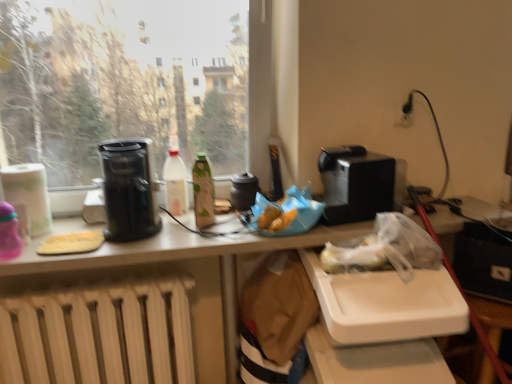
Question: Can you confirm if white matte bottle at center, arranged as the 2th bottle when viewed from the right, is thinner than transparent glass window at upper left?

Choices:
 (A) no
 (B) yes

Answer: (B)

Question: Is transparent glass window at upper left at the back of white matte bottle at center, acting as the 1th bottle starting from the left?

Choices:
 (A) no
 (B) yes

Answer: (B)

Question: From the image's perspective, is white matte bottle at center, arranged as the 2th bottle when viewed from the right, under transparent glass window at upper left?

Choices:
 (A) yes
 (B) no

Answer: (A)

Question: From a real-world perspective, is white matte bottle at center, arranged as the 2th bottle when viewed from the right, positioned over transparent glass window at upper left based on gravity?

Choices:
 (A) yes
 (B) no

Answer: (B)

Question: Does white matte bottle at center, arranged as the 2th bottle when viewed from the right, appear on the left side of transparent glass window at upper left?

Choices:
 (A) yes
 (B) no

Answer: (B)

Question: In terms of height, does black plastic toaster at upper right, which appears as the second appliance when viewed from the left, look taller or shorter compared to green matte bottle at center, which appears as the second bottle when viewed from the left?

Choices:
 (A) short
 (B) tall

Answer: (A)

Question: Considering the relative positions of black plastic toaster at upper right, the 1th appliance from the right, and green matte bottle at center, which appears as the second bottle when viewed from the left, in the image provided, is black plastic toaster at upper right, the 1th appliance from the right, to the left or to the right of green matte bottle at center, which appears as the second bottle when viewed from the left,?

Choices:
 (A) right
 (B) left

Answer: (A)

Question: From a real-world perspective, is black plastic toaster at upper right, the 1th appliance from the right, physically located above or below green matte bottle at center, marked as the 1th bottle in a right-to-left arrangement?

Choices:
 (A) above
 (B) below

Answer: (A)

Question: Is black plastic toaster at upper right, which appears as the second appliance when viewed from the left, bigger or smaller than green matte bottle at center, marked as the 1th bottle in a right-to-left arrangement?

Choices:
 (A) big
 (B) small

Answer: (A)

Question: From a real-world perspective, is green matte bottle at center, marked as the 1th bottle in a right-to-left arrangement, physically located above or below black plastic toaster at upper right, which appears as the second appliance when viewed from the left?

Choices:
 (A) below
 (B) above

Answer: (A)

Question: Is green matte bottle at center, marked as the 1th bottle in a right-to-left arrangement, inside or outside of black plastic toaster at upper right, which appears as the second appliance when viewed from the left?

Choices:
 (A) outside
 (B) inside

Answer: (A)

Question: Is point (205, 160) positioned closer to the camera than point (329, 193)?

Choices:
 (A) closer
 (B) farther

Answer: (B)

Question: Is green matte bottle at center, which appears as the second bottle when viewed from the left, taller or shorter than black plastic toaster at upper right, the 1th appliance from the right?

Choices:
 (A) tall
 (B) short

Answer: (A)

Question: In the image, is black plastic toaster at upper right, which appears as the second appliance when viewed from the left, positioned in front of or behind black plastic coffee maker at left?

Choices:
 (A) behind
 (B) front

Answer: (A)

Question: From a real-world perspective, is black plastic toaster at upper right, which appears as the second appliance when viewed from the left, physically located above or below black plastic coffee maker at left?

Choices:
 (A) below
 (B) above

Answer: (A)